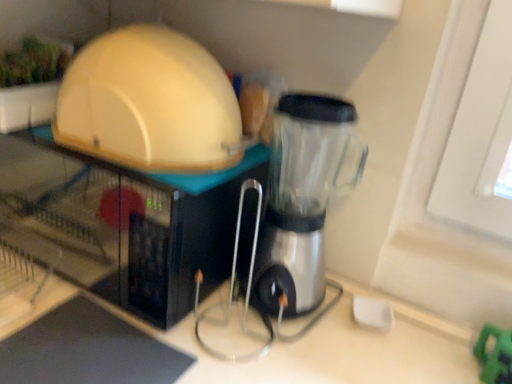
Question: Can you confirm if transparent plastic blender at center is bigger than matte white dome at upper left, acting as the second appliance starting from the bottom?

Choices:
 (A) no
 (B) yes

Answer: (A)

Question: Is transparent plastic blender at center wider than matte white dome at upper left, acting as the first appliance starting from the top?

Choices:
 (A) no
 (B) yes

Answer: (A)

Question: Is transparent plastic blender at center shorter than matte white dome at upper left, acting as the second appliance starting from the bottom?

Choices:
 (A) yes
 (B) no

Answer: (B)

Question: From the image's perspective, is transparent plastic blender at center on top of matte white dome at upper left, acting as the second appliance starting from the bottom?

Choices:
 (A) no
 (B) yes

Answer: (A)

Question: Is transparent plastic blender at center positioned beyond the bounds of matte white dome at upper left, acting as the first appliance starting from the top?

Choices:
 (A) yes
 (B) no

Answer: (A)

Question: Does point (91, 226) appear closer or farther from the camera than point (260, 297)?

Choices:
 (A) closer
 (B) farther

Answer: (B)

Question: Is matte white microwave at upper left, the 2th appliance from the top, situated inside transparent plastic blender at center or outside?

Choices:
 (A) inside
 (B) outside

Answer: (B)

Question: In terms of height, does matte white microwave at upper left, the first appliance from the bottom, look taller or shorter compared to transparent plastic blender at center?

Choices:
 (A) tall
 (B) short

Answer: (B)

Question: Looking at their shapes, would you say matte white microwave at upper left, the first appliance from the bottom, is wider or thinner than transparent plastic blender at center?

Choices:
 (A) wide
 (B) thin

Answer: (A)

Question: Would you say matte white microwave at upper left, the first appliance from the bottom, is inside or outside matte white dome at upper left, acting as the second appliance starting from the bottom?

Choices:
 (A) outside
 (B) inside

Answer: (A)

Question: Is matte white microwave at upper left, the 2th appliance from the top, wider or thinner than matte white dome at upper left, acting as the first appliance starting from the top?

Choices:
 (A) wide
 (B) thin

Answer: (A)

Question: Is matte white microwave at upper left, the 2th appliance from the top, to the left or to the right of matte white dome at upper left, acting as the second appliance starting from the bottom, in the image?

Choices:
 (A) right
 (B) left

Answer: (B)

Question: From their relative heights in the image, would you say matte white microwave at upper left, the first appliance from the bottom, is taller or shorter than matte white dome at upper left, acting as the first appliance starting from the top?

Choices:
 (A) tall
 (B) short

Answer: (A)

Question: Is transparent plastic blender at center bigger or smaller than matte white microwave at upper left, the 2th appliance from the top?

Choices:
 (A) small
 (B) big

Answer: (A)

Question: Considering the positions of transparent plastic blender at center and matte white microwave at upper left, the first appliance from the bottom, in the image, is transparent plastic blender at center wider or thinner than matte white microwave at upper left, the first appliance from the bottom,?

Choices:
 (A) thin
 (B) wide

Answer: (A)